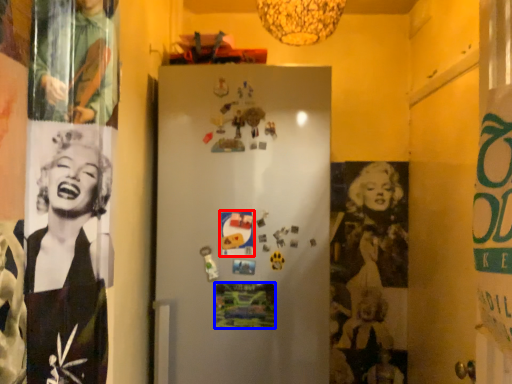
Question: Which point is further to the camera, poster page (highlighted by a red box) or poster page (highlighted by a blue box)?

Choices:
 (A) poster page
 (B) poster page

Answer: (B)